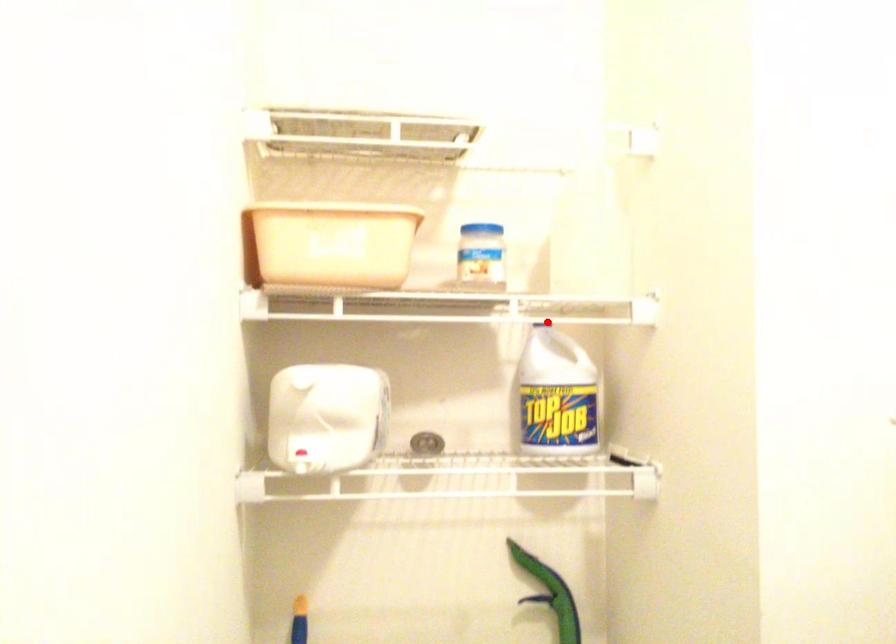
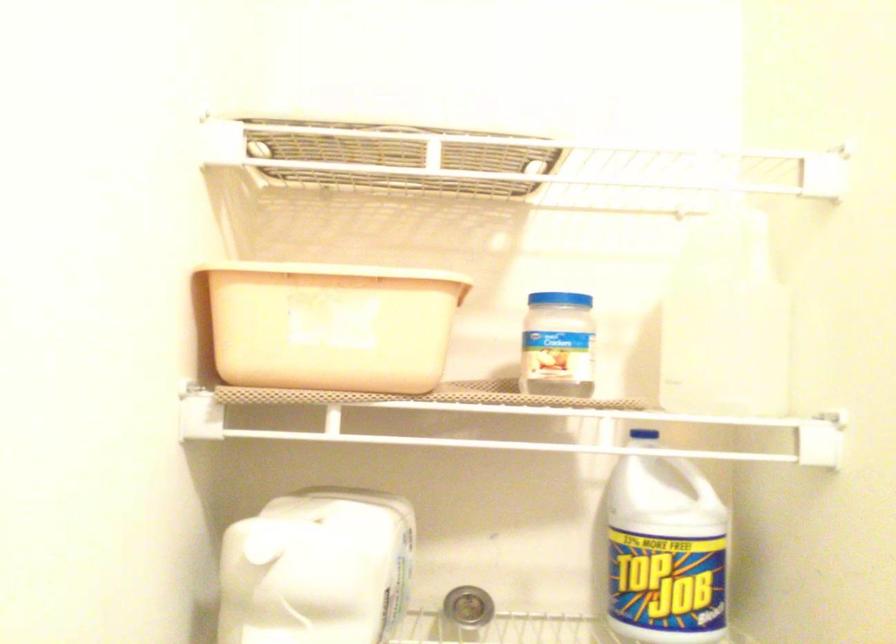
Where in the second image is the point corresponding to the highlighted location from the first image?

(650, 435)